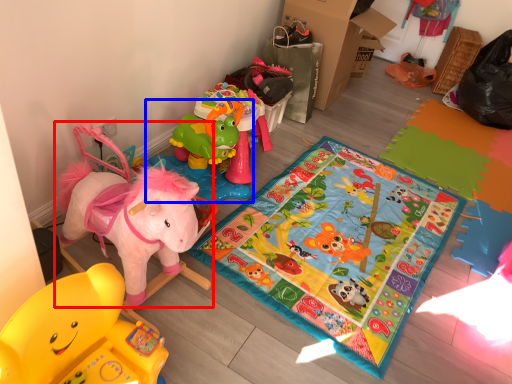
Question: Which point is further to the camera, toy (highlighted by a red box) or toy (highlighted by a blue box)?

Choices:
 (A) toy
 (B) toy

Answer: (B)